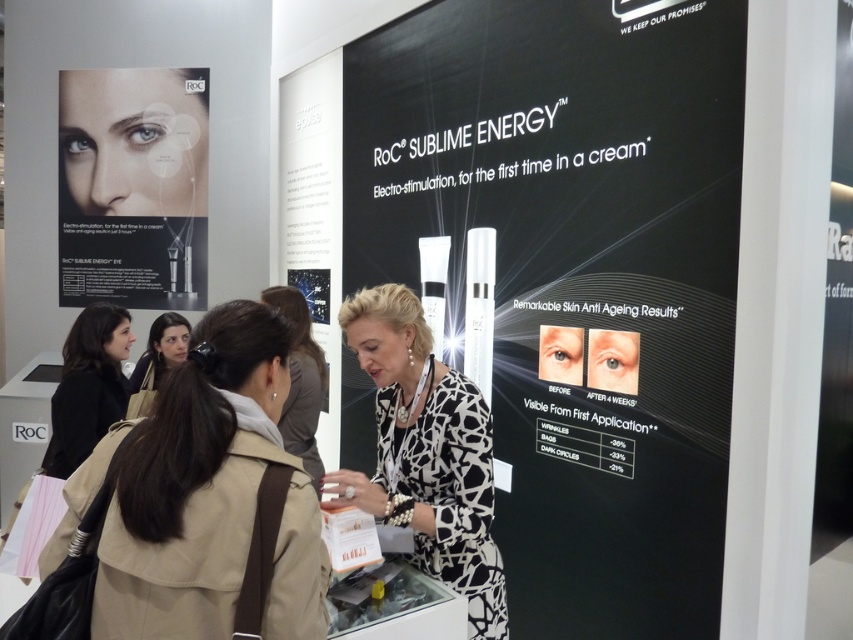
Is point (169, 438) positioned in front of point (126, 404)?

Yes.

In the scene shown: Who is more forward, [312,572] or [149,358]?

Point [312,572]

The image size is (853, 640). In order to click on tan leather jacket at lower left in this screenshot , I will do `click(202, 496)`.

Does black matte jacket at lower left come behind matte black hair at center?

No, it is not.

The width and height of the screenshot is (853, 640). What are the coordinates of `black matte jacket at lower left` in the screenshot? It's located at (88, 387).

Is tan leather jacket at lower left wider than black matte jacket at lower left?

Correct, the width of tan leather jacket at lower left exceeds that of black matte jacket at lower left.

The image size is (853, 640). In order to click on tan leather jacket at lower left in this screenshot , I will do `click(202, 496)`.